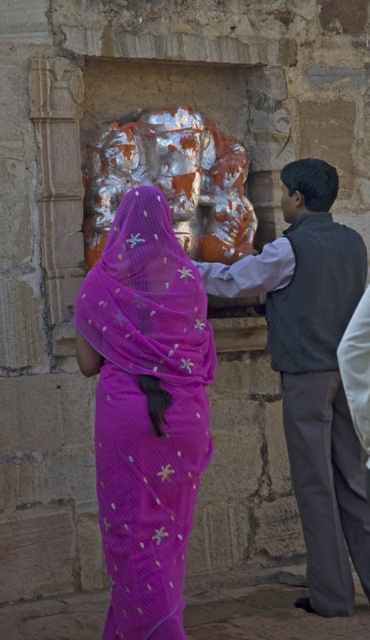
Does gray woolen vest at center appear on the right side of shiny metallic statue at center?

Indeed, gray woolen vest at center is positioned on the right side of shiny metallic statue at center.

Does gray woolen vest at center come behind shiny metallic statue at center?

No, gray woolen vest at center is in front of shiny metallic statue at center.

The image size is (370, 640). Identify the location of gray woolen vest at center. (313, 372).

Does purple sheer sari at center appear on the left side of shiny metallic statue at center?

Yes, purple sheer sari at center is to the left of shiny metallic statue at center.

Between purple sheer sari at center and shiny metallic statue at center, which one appears on the right side from the viewer's perspective?

From the viewer's perspective, shiny metallic statue at center appears more on the right side.

Image resolution: width=370 pixels, height=640 pixels. What are the coordinates of `purple sheer sari at center` in the screenshot? It's located at (146, 410).

Does purple sheer sari at center appear on the left side of gray woolen vest at center?

Correct, you'll find purple sheer sari at center to the left of gray woolen vest at center.

Is point (160, 488) less distant than point (351, 614)?

Yes.

Is point (148, 404) closer to camera compared to point (291, 262)?

Yes, point (148, 404) is closer to viewer.

The image size is (370, 640). Find the location of `purple sheer sari at center`. purple sheer sari at center is located at coordinates (146, 410).